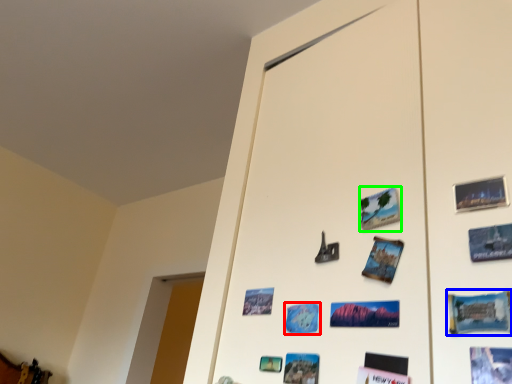
Question: Based on their relative distances, which object is nearer to postcard (highlighted by a red box)? Choose from postcard (highlighted by a blue box) and postcard (highlighted by a green box).

Choices:
 (A) postcard
 (B) postcard

Answer: (B)